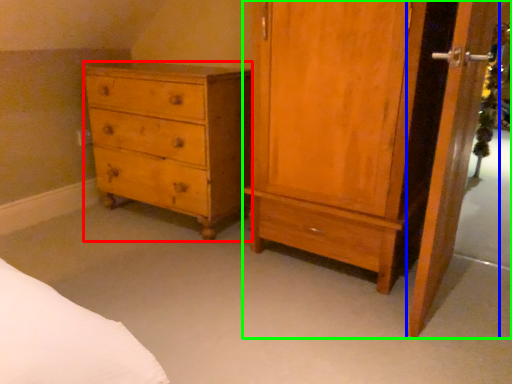
Question: Which is farther away from chest of drawers (highlighted by a red box)? screen door (highlighted by a blue box) or nightstand (highlighted by a green box)?

Choices:
 (A) screen door
 (B) nightstand

Answer: (A)